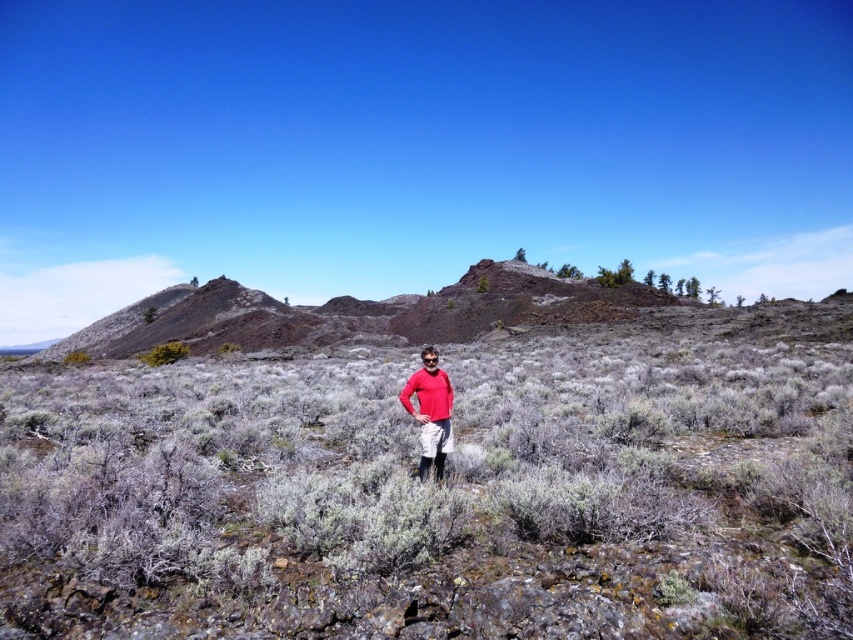
You are navigating through the rugged terrain in the foreground of the landscape. You have two points to reach, point (428, 417) and point (144, 362). Which point is closer to you as you move forward?

Point (428, 417) is in front of point (144, 362), so it is closer to you as you move forward.